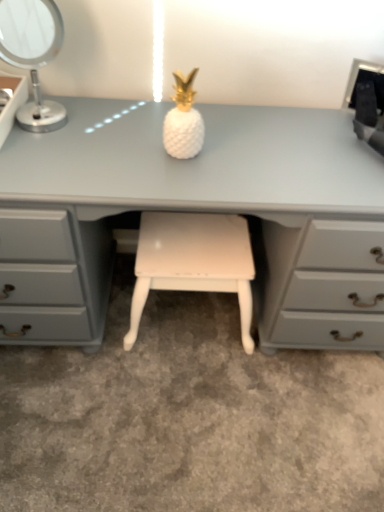
Identify the location of vacant space in front of black plastic desktop computer at upper right. (334, 148).